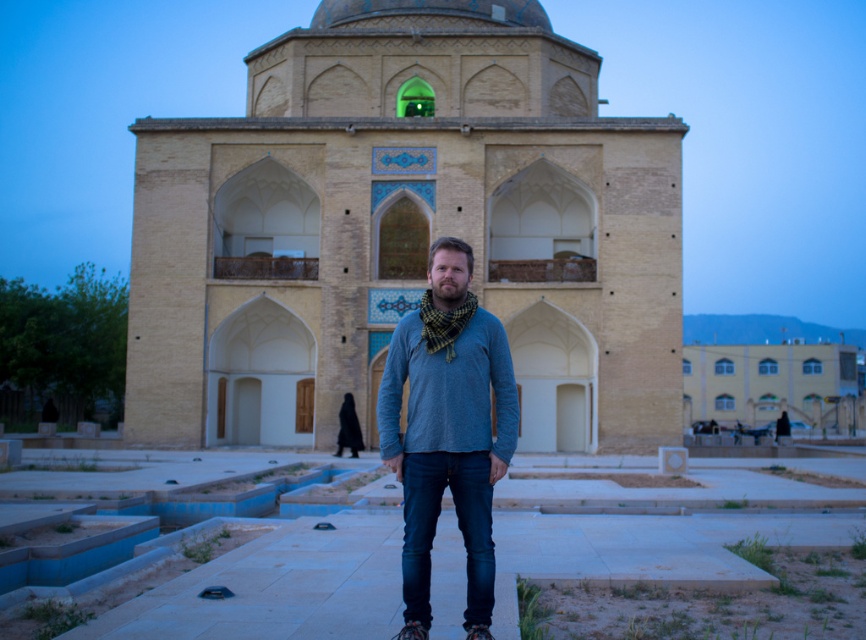
Where is `beige stone building at center`? The height and width of the screenshot is (640, 866). beige stone building at center is located at coordinates (405, 230).

Is point (622, 275) positioned in front of point (412, 403)?

No.

Based on the photo, who is more forward, (509, 289) or (483, 340)?

Point (483, 340) is more forward.

Where is `beige stone building at center`? beige stone building at center is located at coordinates (x=405, y=230).

Does beige stone building at center have a lesser height compared to blue cotton shirt at center?

Incorrect, beige stone building at center's height does not fall short of blue cotton shirt at center's.

Is beige stone building at center wider than blue cotton shirt at center?

Yes, beige stone building at center is wider than blue cotton shirt at center.

Between point (314, 100) and point (421, 513), which one is positioned behind?

The point (314, 100) is more distant.

What are the coordinates of `beige stone building at center` in the screenshot? It's located at (405, 230).

Is dark blue denim jeans at center to the right of checkered wool scarf at center from the viewer's perspective?

Indeed, dark blue denim jeans at center is positioned on the right side of checkered wool scarf at center.

Between point (470, 612) and point (469, 301), which one is positioned behind?

The point (469, 301) is more distant.

Locate an element on the screen. dark blue denim jeans at center is located at coordinates (457, 525).